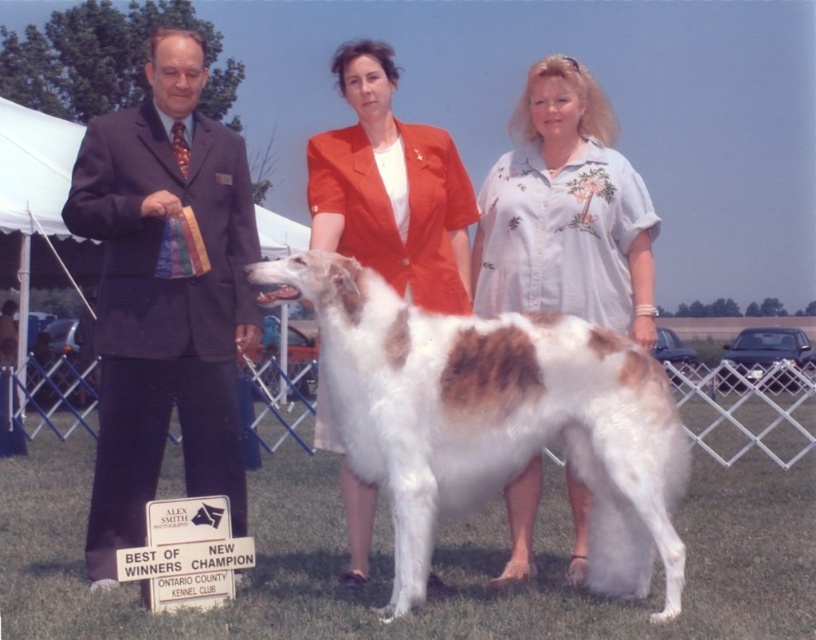
Does white fur at center appear under dark suit at left?

Yes.

From the picture: Does white fur at center lie in front of dark suit at left?

Yes.

Who is more distant from viewer, (650, 387) or (102, 324)?

The point (102, 324) is behind.

The image size is (816, 640). Identify the location of white fur at center. (494, 419).

The image size is (816, 640). I want to click on white fur at center, so click(x=494, y=419).

Does white fur at center have a larger size compared to light blue floral blouse at center?

Yes.

Which is behind, point (455, 332) or point (562, 250)?

The point (562, 250) is behind.

The image size is (816, 640). Identify the location of white fur at center. (494, 419).

Based on the photo, is light blue floral blouse at center shorter than matte orange blazer at center?

In fact, light blue floral blouse at center may be taller than matte orange blazer at center.

Between light blue floral blouse at center and matte orange blazer at center, which one is positioned higher?

light blue floral blouse at center

Is point (551, 109) positioned before point (411, 168)?

That is False.

Locate an element on the screen. light blue floral blouse at center is located at coordinates (565, 211).